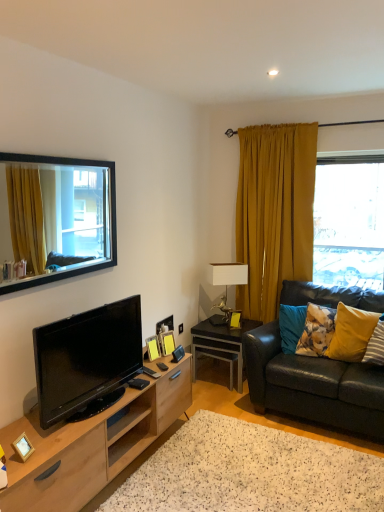
What do you see at coordinates (23, 447) in the screenshot?
I see `wooden picture frame at lower left, positioned as the 4th picture frame in back-to-front order` at bounding box center [23, 447].

What are the coordinates of `white ceramic lamp at center` in the screenshot? It's located at (229, 274).

Measure the distance between point (84, 234) and camera.

A distance of 8.94 feet exists between point (84, 234) and camera.

What do you see at coordinates (220, 343) in the screenshot? I see `black glossy side table at lower right` at bounding box center [220, 343].

Locate an element on the screen. The image size is (384, 512). black glossy tv at lower left is located at coordinates (86, 357).

Where is `mustard velvet curtain at right`? Image resolution: width=384 pixels, height=512 pixels. mustard velvet curtain at right is located at coordinates (274, 212).

The image size is (384, 512). I want to click on floral fabric pillow at right, the 3th pillow positioned from the right, so click(x=317, y=330).

Is mustard velvet curtain at right looking in the opposite direction of floral fabric pillow at right, the 3th pillow positioned from the right?

No, floral fabric pillow at right, the 3th pillow positioned from the right, is not at the back of mustard velvet curtain at right.

Is point (255, 260) closer or farther from the camera than point (326, 329)?

Point (255, 260) appears to be farther away from the viewer than point (326, 329).

Would you say mustard velvet curtain at right is outside floral fabric pillow at right, the first pillow positioned from the left?

Indeed, mustard velvet curtain at right is completely outside floral fabric pillow at right, the first pillow positioned from the left.

Are mustard velvet curtain at right and floral fabric pillow at right, the first pillow positioned from the left, located far from each other?

They are positioned close to each other.

Who is smaller, mustard velvet curtain at right or black-framed mirror at upper left, marked as the second window in a right-to-left arrangement?

black-framed mirror at upper left, marked as the second window in a right-to-left arrangement, is smaller.

Would you consider mustard velvet curtain at right to be distant from black-framed mirror at upper left, which is the 1th window in front-to-back order?

Indeed, mustard velvet curtain at right is not near black-framed mirror at upper left, which is the 1th window in front-to-back order.

Can you confirm if mustard velvet curtain at right is positioned to the right of black-framed mirror at upper left, the first window from the left?

Indeed, mustard velvet curtain at right is positioned on the right side of black-framed mirror at upper left, the first window from the left.

Considering the sizes of objects mustard velvet curtain at right and black-framed mirror at upper left, which is counted as the second window, starting from the back, in the image provided, who is taller, mustard velvet curtain at right or black-framed mirror at upper left, which is counted as the second window, starting from the back,?

With more height is mustard velvet curtain at right.

Between point (320, 342) and point (370, 346), which one is positioned behind?

The point (320, 342) is behind.

From a real-world perspective, which is physically below, floral fabric pillow at right, the 3th pillow positioned from the right, or yellow velvet pillow at right, the 3th pillow when ordered from left to right?

In real-world perspective, floral fabric pillow at right, the 3th pillow positioned from the right, is lower.

Is floral fabric pillow at right, the 3th pillow positioned from the right, facing towards yellow velvet pillow at right, the 1th pillow in the right-to-left sequence?

No, floral fabric pillow at right, the 3th pillow positioned from the right, is not turned towards yellow velvet pillow at right, the 1th pillow in the right-to-left sequence.

Could you tell me if yellow velvet pillow at right, the 3th pillow when ordered from left to right, is facing white ceramic lamp at center?

No, yellow velvet pillow at right, the 3th pillow when ordered from left to right, is not facing towards white ceramic lamp at center.

From a real-world perspective, who is located lower, yellow velvet pillow at right, the 3th pillow when ordered from left to right, or white ceramic lamp at center?

A: From a 3D spatial view, yellow velvet pillow at right, the 3th pillow when ordered from left to right, is below.

Considering the relative positions of yellow velvet pillow at right, the 3th pillow when ordered from left to right, and white ceramic lamp at center in the image provided, is yellow velvet pillow at right, the 3th pillow when ordered from left to right, behind white ceramic lamp at center?

No, yellow velvet pillow at right, the 3th pillow when ordered from left to right, is closer to the viewer.

Is black glossy side table at lower right directly adjacent to floral fabric pillow at right, the 3th pillow positioned from the right?

black glossy side table at lower right and floral fabric pillow at right, the 3th pillow positioned from the right, are not in contact.

Locate an element on the screen. This screenshot has height=512, width=384. table below the floral fabric pillow at right, the 3th pillow positioned from the right (from the image's perspective) is located at coordinates (220, 343).

From the image's perspective, between black glossy side table at lower right and floral fabric pillow at right, the first pillow positioned from the left, which one is located above?

floral fabric pillow at right, the first pillow positioned from the left, from the image's perspective.

Does point (210, 322) appear closer or farther from the camera than point (334, 309)?

Point (210, 322) is farther from the camera than point (334, 309).

Is yellow fabric pillow at right, arranged as the second pillow when viewed from the left, far away from beech wood tv stand at lower left?

yellow fabric pillow at right, arranged as the second pillow when viewed from the left, is positioned a significant distance from beech wood tv stand at lower left.

This screenshot has height=512, width=384. I want to click on the 2nd pillow counting from the right of the beech wood tv stand at lower left, so click(351, 333).

Is yellow fabric pillow at right, which is counted as the second pillow, starting from the right, bigger than beech wood tv stand at lower left?

No, yellow fabric pillow at right, which is counted as the second pillow, starting from the right, is not bigger than beech wood tv stand at lower left.

Is beech wood tv stand at lower left inside yellow fabric pillow at right, arranged as the second pillow when viewed from the left?

No.

Does white ceramic lamp at center turn towards wooden picture frame at center, which is the 3th picture frame from right to left?

No.

Which object is positioned more to the left, white ceramic lamp at center or wooden picture frame at center, marked as the 3th picture frame in a back-to-front arrangement?

wooden picture frame at center, marked as the 3th picture frame in a back-to-front arrangement.

Does white ceramic lamp at center have a lesser width compared to wooden picture frame at center, arranged as the 2th picture frame when viewed from the front?

No, white ceramic lamp at center is not thinner than wooden picture frame at center, arranged as the 2th picture frame when viewed from the front.

Identify the location of curtain lying above the floral fabric pillow at right, the 3th pillow positioned from the right (from the image's perspective). The height and width of the screenshot is (512, 384). (274, 212).

This screenshot has height=512, width=384. Identify the location of window located in front of the mustard velvet curtain at right. (59, 217).

Based on their spatial positions, is wooden picture frame at lower left, the first picture frame when ordered from front to back, or white speckled rug at lower center further from mustard velvet curtain at right?

Based on the image, wooden picture frame at lower left, the first picture frame when ordered from front to back, appears to be further to mustard velvet curtain at right.

In the scene shown: From the image, which object appears to be nearer to wooden picture frame at center, the 2th picture frame in the left-to-right sequence, transparent glass window at upper right, which is counted as the 2th window, starting from the front, or white ceramic lamp at center?

Based on the image, white ceramic lamp at center appears to be nearer to wooden picture frame at center, the 2th picture frame in the left-to-right sequence.

When comparing their distances from wooden picture frame at lower left, the first picture frame when ordered from front to back, does wooden picture frame at center, the second picture frame positioned from the back, or mustard velvet curtain at right seem further?

mustard velvet curtain at right is further to wooden picture frame at lower left, the first picture frame when ordered from front to back.

Which object lies further to the anchor point black glossy tv at lower left, wooden picture frame at lower left, marked as the 4th picture frame in a right-to-left arrangement, or leather couch at right?

Among the two, leather couch at right is located further to black glossy tv at lower left.

Estimate the real-world distances between objects in this image. Which object is closer to white ceramic lamp at center, yellow fabric pillow at right, arranged as the second pillow when viewed from the left, or floral fabric pillow at right, the 3th pillow positioned from the right?

The object closer to white ceramic lamp at center is floral fabric pillow at right, the 3th pillow positioned from the right.

Looking at the image, which one is located further to wooden picture frame at center, the 3th picture frame viewed from the left, wooden picture frame at center, arranged as the 2th picture frame when viewed from the front, or leather couch at right?

Based on the image, leather couch at right appears to be further to wooden picture frame at center, the 3th picture frame viewed from the left.

Based on their spatial positions, is white ceramic lamp at center or white speckled rug at lower center closer to beech wood tv stand at lower left?

Among the two, white speckled rug at lower center is located nearer to beech wood tv stand at lower left.

Looking at the image, which one is located further to leather couch at right, wooden picture frame at center, the second picture frame positioned from the back, or white ceramic lamp at center?

Among the two, white ceramic lamp at center is located further to leather couch at right.

Locate an element on the screen. Image resolution: width=384 pixels, height=512 pixels. studio couch positioned between white speckled rug at lower center and transparent glass window at upper right, which is counted as the first window, starting from the right, from near to far is located at coordinates (313, 386).

You are a GUI agent. You are given a task and a screenshot of the screen. Output one action in this format:
    pyautogui.click(x=<x>, y=<y>)
    Task: Click on the studio couch between black glossy tv at lower left and transparent glass window at upper right, arranged as the second window when viewed from the left
    
    Given the screenshot: What is the action you would take?
    pyautogui.click(x=313, y=386)

At what (x,y) coordinates should I click in order to perform the action: click on studio couch between beech wood tv stand at lower left and yellow fabric pillow at right, which is counted as the second pillow, starting from the right, from left to right. Please return your answer as a coordinate pair (x, y). Looking at the image, I should click on (313, 386).

Where is `curtain between wooden picture frame at center, the 2th picture frame when ordered from right to left, and yellow velvet pillow at right, the 3th pillow when ordered from left to right`? Image resolution: width=384 pixels, height=512 pixels. curtain between wooden picture frame at center, the 2th picture frame when ordered from right to left, and yellow velvet pillow at right, the 3th pillow when ordered from left to right is located at coordinates (274, 212).